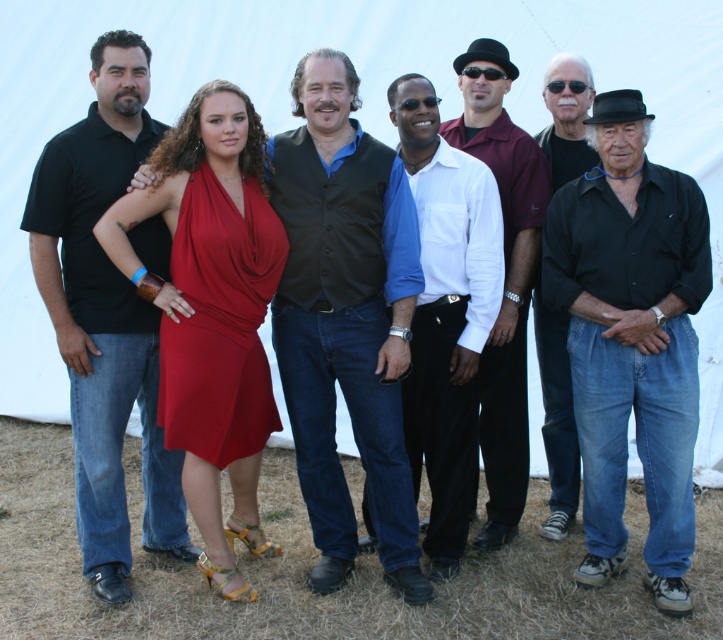
You are a photographer trying to capture a group photo of the black matte shirt at center and the black matte shirt at right. Based on their positions, which one should you adjust to be closer to the camera to ensure both are in focus?

The black matte shirt at right should be adjusted to be closer to the camera since the black matte shirt at center is positioned on the right side of it, meaning the black matte shirt at right is further away from the camera.

You are a photographer standing at the center of the group. You want to take a photo of the matte black vest at center and the person wearing it. Can you fit both in your camera frame if your camera has a maximum width of 5 meters?

The two objects are 4.98 meters apart, so yes, the photographer can fit both the matte black vest at center and the person wearing it in the camera frame since the distance between them is within the 5 meters limit.